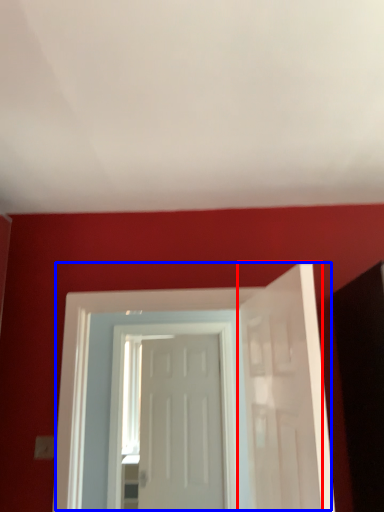
Question: Which object is further to the camera taking this photo, door (highlighted by a red box) or door (highlighted by a blue box)?

Choices:
 (A) door
 (B) door

Answer: (B)